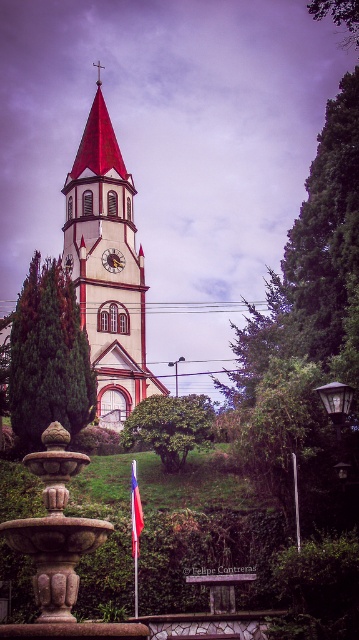
Who is more forward, (40,310) or (161,424)?

Point (161,424) is in front.

Measure the distance from green leafy tree at center to green leafy bush at center.

27.82 feet

This screenshot has width=359, height=640. Describe the element at coordinates (48, 356) in the screenshot. I see `green leafy tree at center` at that location.

This screenshot has height=640, width=359. I want to click on green leafy tree at center, so click(x=48, y=356).

Is stone fountain at center wider than red fabric flag at lower center?

Indeed, stone fountain at center has a greater width compared to red fabric flag at lower center.

Image resolution: width=359 pixels, height=640 pixels. What are the coordinates of `stone fountain at center` in the screenshot? It's located at 54,529.

Between point (92, 330) and point (115, 266), which one is positioned in front?

Point (92, 330) is in front.

Can you confirm if smooth white steeple at center is positioned to the left of gold textured clock at center?

Correct, you'll find smooth white steeple at center to the left of gold textured clock at center.

I want to click on smooth white steeple at center, so click(x=105, y=269).

Identify the location of smooth white steeple at center. (105, 269).